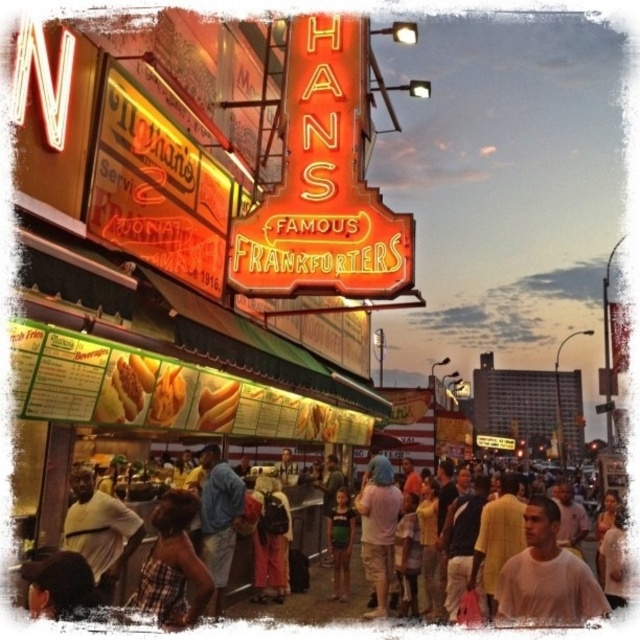
Question: Which object is the farthest from the light blue fabric shirt at center?

Choices:
 (A) white t-shirt at lower left
 (B) plaid fabric shirt at lower left
 (C) blue denim shirt at center
 (D) golden fried corn at center

Answer: (A)

Question: Can you confirm if plaid fabric shirt at lower left is smaller than golden fried corn at center?

Choices:
 (A) yes
 (B) no

Answer: (B)

Question: Which is nearer to the golden fried corn at center?

Choices:
 (A) plaid fabric shirt at lower left
 (B) white t-shirt at lower left
 (C) light brown fabric shirt at lower center

Answer: (A)

Question: Is golden fried hot dog at center to the left of golden fried corn at center from the viewer's perspective?

Choices:
 (A) no
 (B) yes

Answer: (B)

Question: Is plaid fabric shirt at lower left thinner than orange fabric dress at center?

Choices:
 (A) no
 (B) yes

Answer: (A)

Question: Considering the real-world distances, which object is farthest from the plaid fabric shirt at lower left?

Choices:
 (A) light brown fabric shirt at lower center
 (B) golden fried hot dog at center
 (C) white t-shirt at lower left
 (D) light beige cotton shirt at center

Answer: (D)